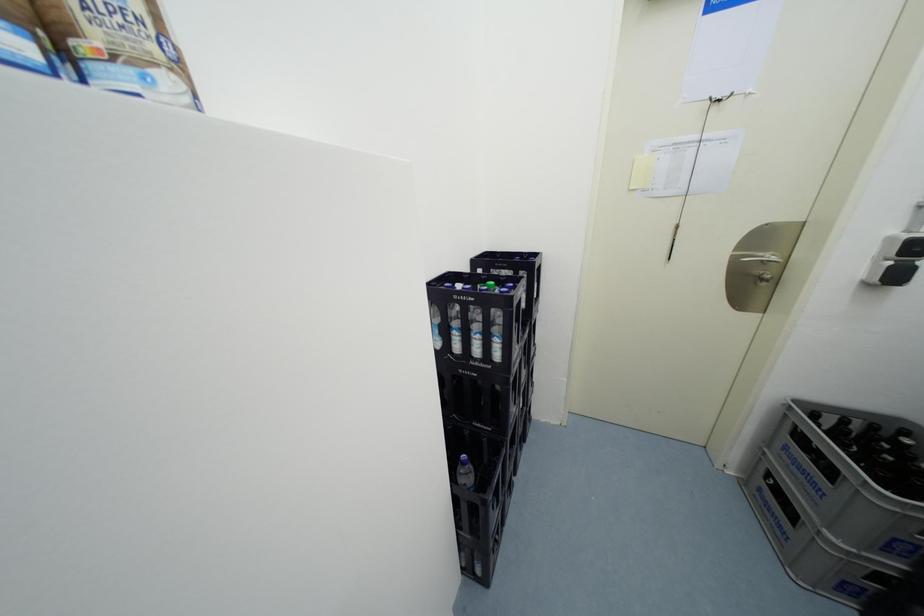
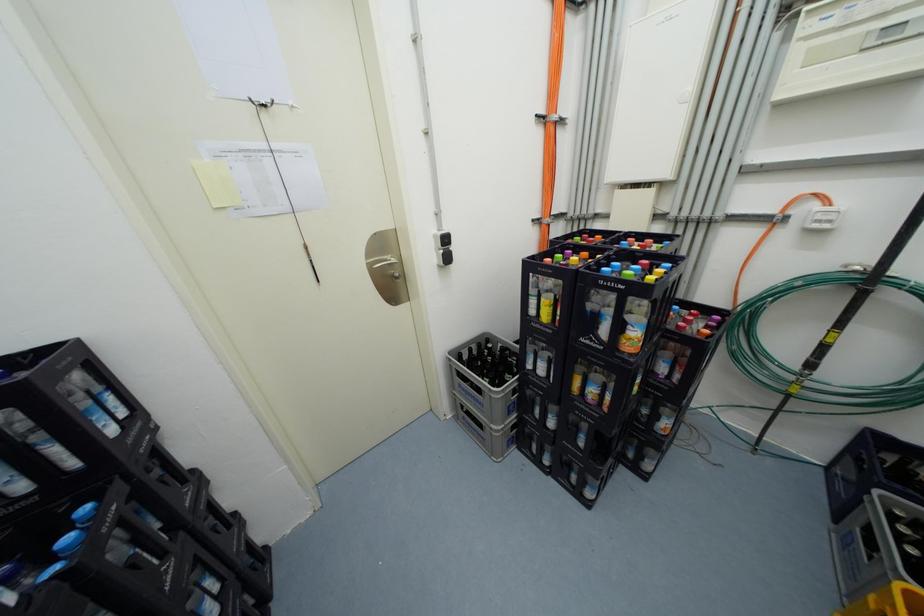
Question: Based on the continuous images, in which direction is the camera rotating? Reply with the corresponding letter.

Choices:
 (A) Left
 (B) Right
 (C) Up
 (D) Down

Answer: (B)